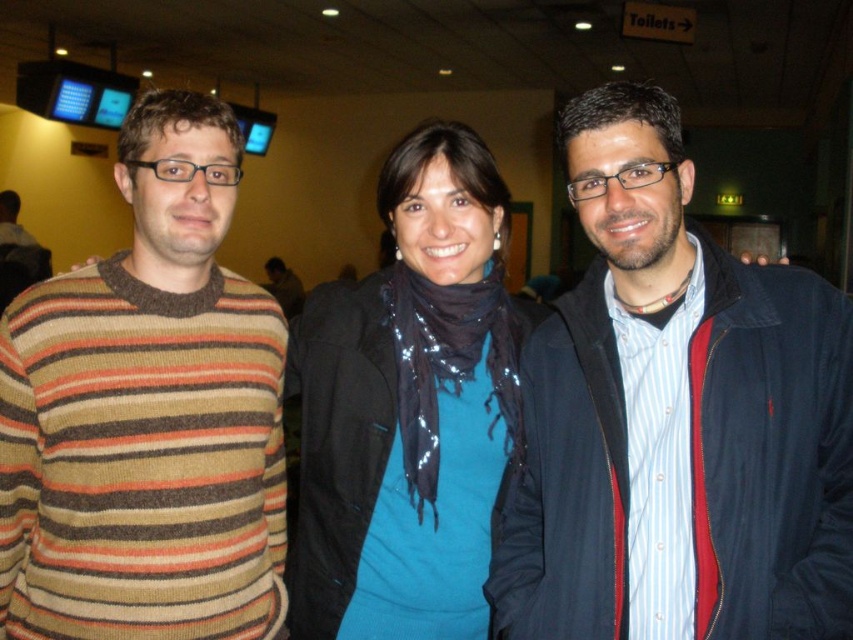
Consider the image. You are planning to take a photo of the striped knit sweater at left and the blue sequined scarf at center for a fashion catalog. Which item should you focus on first if you want to capture the taller object in the image?

The striped knit sweater at left is taller than the blue sequined scarf at center, so you should focus on the striped knit sweater at left first to capture the taller object.

Consider the image. You are a photographer at this event and need to ensure all participants are visible in a group photo. Considering the dark blue jacket at center and the striped knit sweater at left, which clothing item is wider and might require more space in the frame?

The dark blue jacket at center is wider than the striped knit sweater at left, so it requires more space in the frame.